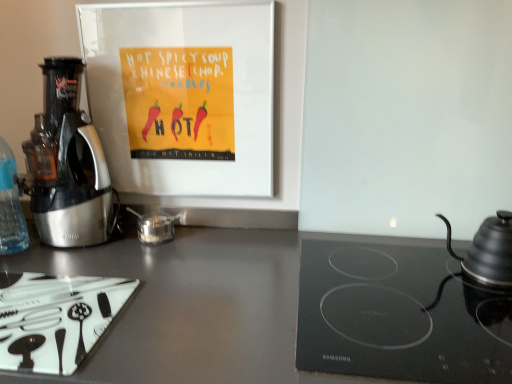
Identify the location of vacant space to the right of transparent glass tea pot at center. (220, 241).